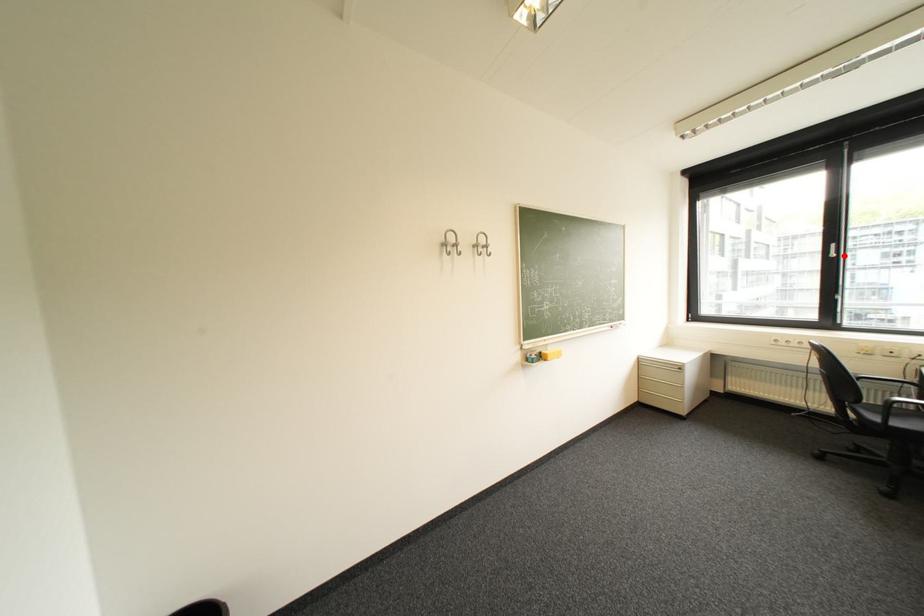
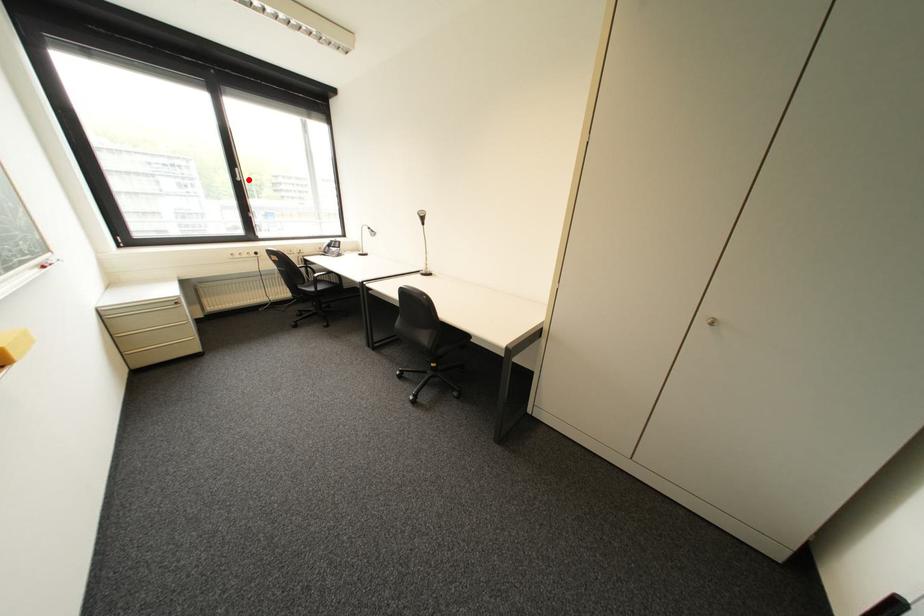
I am providing you with two images of the same scene from different viewpoints. A red point is marked on the first image and another point is marked on the second image. Are the points marked in image1 and image2 representing the same 3D position?

Yes